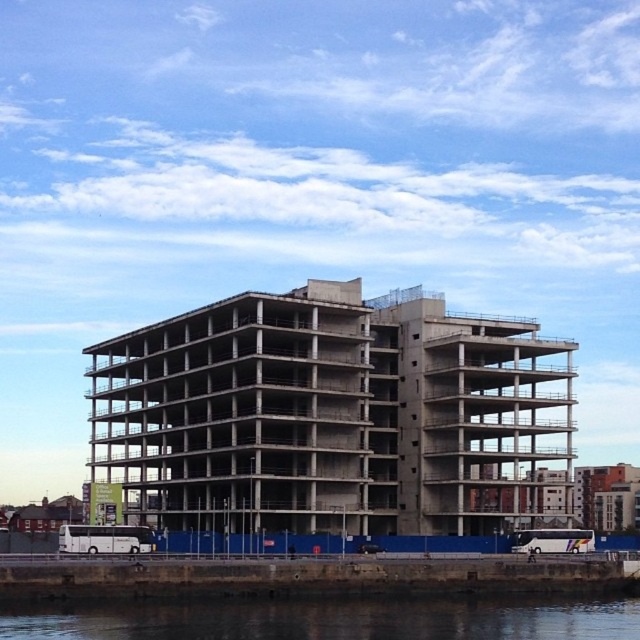
Find the location of a particular element. Image resolution: width=640 pixels, height=640 pixels. concrete building at center is located at coordinates (330, 416).

Does point (266, 426) come behind point (576, 531)?

Yes, it is behind point (576, 531).

This screenshot has width=640, height=640. Find the location of `concrete building at center`. concrete building at center is located at coordinates (330, 416).

Is concrete building at center further to the viewer compared to transparent water at lower center?

Yes.

Measure the distance between concrete building at center and camera.

concrete building at center is 300.61 feet away from camera.

Where is `concrete building at center`? concrete building at center is located at coordinates (330, 416).

Between point (76, 612) and point (566, 536), which one is positioned behind?

The point (566, 536) is more distant.

Consider the image. Measure the distance from transparent water at lower center to white plastic bus at lower center.

transparent water at lower center is 20.01 meters away from white plastic bus at lower center.

The image size is (640, 640). I want to click on transparent water at lower center, so click(332, 620).